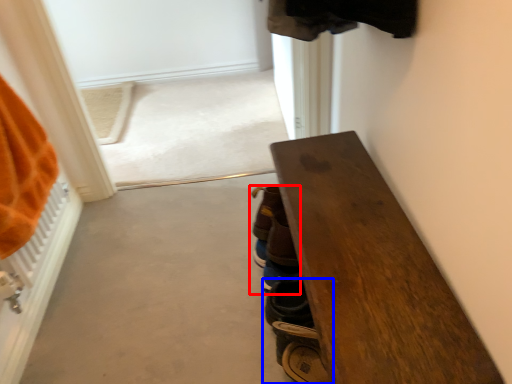
Question: Which of the following is the farthest to the observer, footwear (highlighted by a red box) or footwear (highlighted by a blue box)?

Choices:
 (A) footwear
 (B) footwear

Answer: (A)